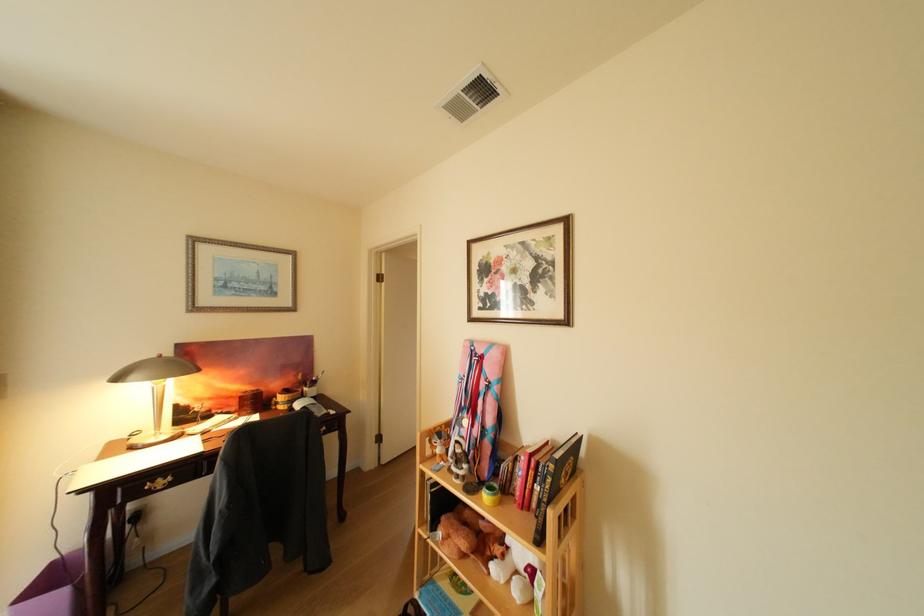
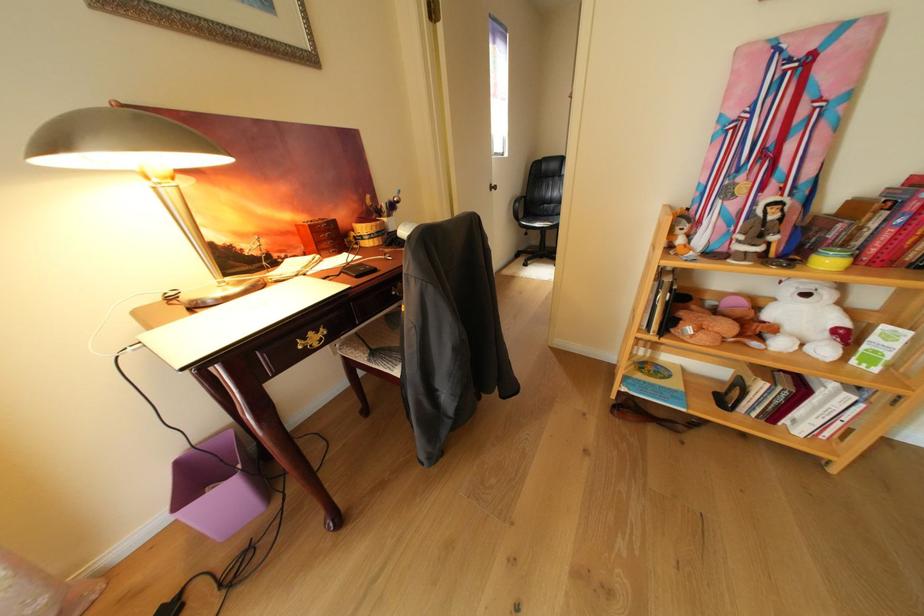
The point at (140, 438) is marked in the first image. Where is the corresponding point in the second image?

(171, 301)